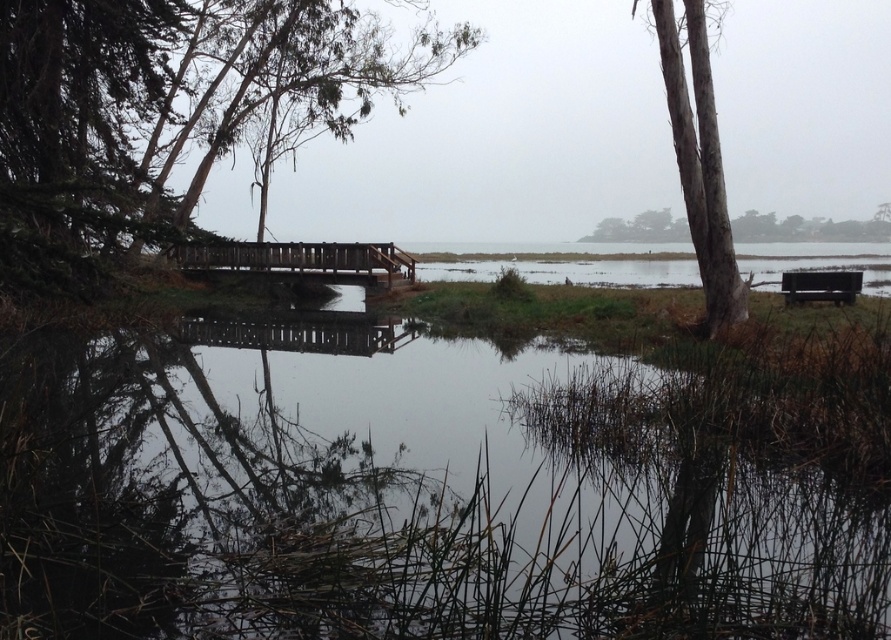
You are an architect designing a new wetland park. You need to ensure that the green matte tree at left and the wooden bridge at center are placed in a way that maintains the natural beauty of the area. Considering their widths, which object should be positioned closer to the visitor entrance to avoid overcrowding the path?

The wooden bridge at center should be positioned closer to the visitor entrance because the green matte tree at left is wider than the wooden bridge at center. Placing the wider tree farther away can help maintain open space near the entrance.

You are a nature photographer standing at the wooden bridge. You want to capture a photo of the dark brown wooden bench at right and the smooth bark tree at upper right. Which object will appear larger in the photo?

The smooth bark tree at upper right will appear larger in the photo because it is much taller than the dark brown wooden bench at right.

You are planning to take a photo of the smooth bark tree at upper right and the dark brown wooden bench at right from the same distance. Which object will appear wider in the photo?

The smooth bark tree at upper right will appear wider in the photo because its width is larger than the dark brown wooden bench at right.